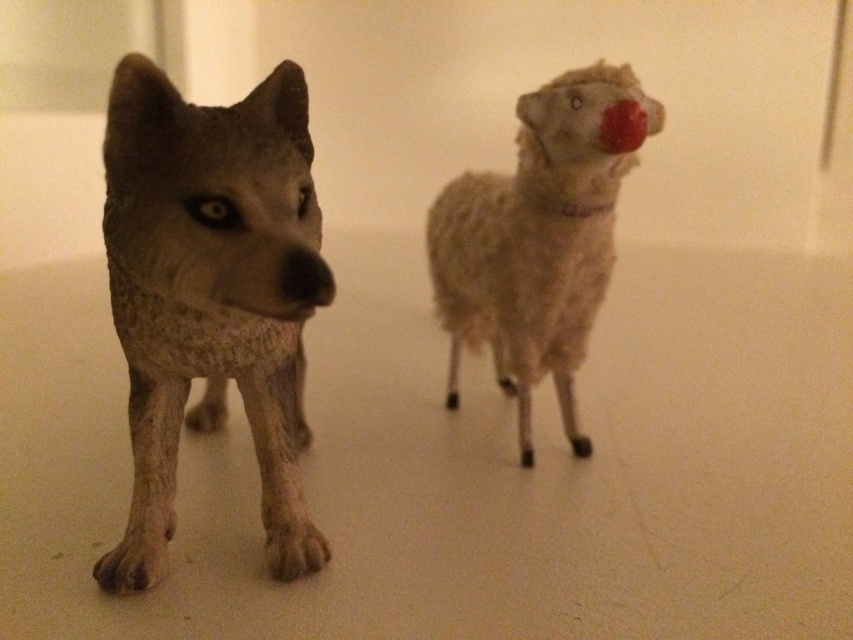
Can you confirm if gray textured wolf at left is wider than fuzzy beige sheep at center?

In fact, gray textured wolf at left might be narrower than fuzzy beige sheep at center.

Which is above, gray textured wolf at left or fuzzy beige sheep at center?

fuzzy beige sheep at center

The width and height of the screenshot is (853, 640). Identify the location of gray textured wolf at left. (212, 294).